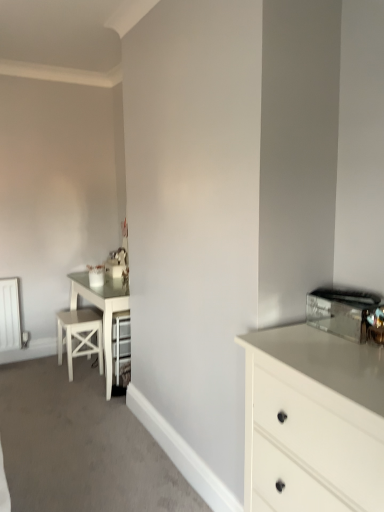
Question: Considering the relative sizes of white wood bar stool at left and white glossy chest of drawers at right in the image provided, is white wood bar stool at left thinner than white glossy chest of drawers at right?

Choices:
 (A) no
 (B) yes

Answer: (B)

Question: From the image's perspective, does white wood bar stool at left appear lower than white glossy chest of drawers at right?

Choices:
 (A) yes
 (B) no

Answer: (B)

Question: Is white wood bar stool at left taller than white glossy chest of drawers at right?

Choices:
 (A) no
 (B) yes

Answer: (A)

Question: Would you consider white wood bar stool at left to be distant from white glossy chest of drawers at right?

Choices:
 (A) no
 (B) yes

Answer: (B)

Question: Can you confirm if white wood bar stool at left is positioned to the left of white glossy chest of drawers at right?

Choices:
 (A) yes
 (B) no

Answer: (A)

Question: From a real-world perspective, is white wood bar stool at left below white glossy chest of drawers at right?

Choices:
 (A) yes
 (B) no

Answer: (A)

Question: Considering the relative sizes of shiny metallic toaster at upper right and white glossy chest of drawers at right in the image provided, is shiny metallic toaster at upper right wider than white glossy chest of drawers at right?

Choices:
 (A) no
 (B) yes

Answer: (A)

Question: Can you see shiny metallic toaster at upper right touching white glossy chest of drawers at right?

Choices:
 (A) yes
 (B) no

Answer: (B)

Question: From a real-world perspective, is shiny metallic toaster at upper right beneath white glossy chest of drawers at right?

Choices:
 (A) no
 (B) yes

Answer: (A)

Question: Can you confirm if shiny metallic toaster at upper right is thinner than white glossy chest of drawers at right?

Choices:
 (A) yes
 (B) no

Answer: (A)

Question: From the image's perspective, does shiny metallic toaster at upper right appear lower than white glossy chest of drawers at right?

Choices:
 (A) no
 (B) yes

Answer: (A)

Question: Is shiny metallic toaster at upper right outside of white glossy chest of drawers at right?

Choices:
 (A) yes
 (B) no

Answer: (A)

Question: From a real-world perspective, is white glossy chest of drawers at right below shiny metallic toaster at upper right?

Choices:
 (A) yes
 (B) no

Answer: (A)